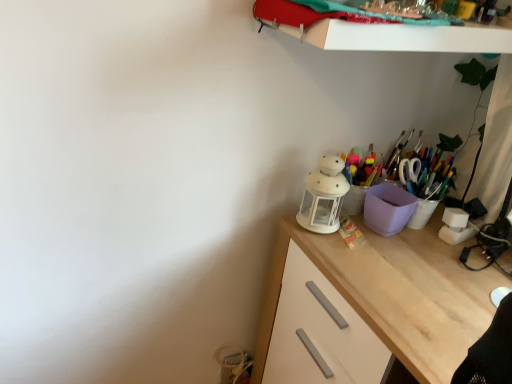
Where is `light wood desk at lower right`? This screenshot has width=512, height=384. light wood desk at lower right is located at coordinates (393, 294).

Describe the element at coordinates (393, 294) in the screenshot. I see `light wood desk at lower right` at that location.

Image resolution: width=512 pixels, height=384 pixels. In order to click on white glossy shelf at upper center in this screenshot , I will do `click(379, 32)`.

This screenshot has width=512, height=384. What do you see at coordinates (379, 32) in the screenshot?
I see `white glossy shelf at upper center` at bounding box center [379, 32].

Measure the distance between white glossy shelf at upper center and camera.

The depth of white glossy shelf at upper center is 28.54 inches.

The width and height of the screenshot is (512, 384). Find the location of `light wood desk at lower right`. light wood desk at lower right is located at coordinates (393, 294).

Is white glossy shelf at upper center to the left of light wood desk at lower right from the viewer's perspective?

Yes, white glossy shelf at upper center is to the left of light wood desk at lower right.

Relative to light wood desk at lower right, is white glossy shelf at upper center in front or behind?

In the image, white glossy shelf at upper center appears in front of light wood desk at lower right.

Is point (275, 14) closer to camera compared to point (452, 246)?

Yes, point (275, 14) is closer to viewer.

From the image's perspective, is white glossy shelf at upper center under light wood desk at lower right?

Actually, white glossy shelf at upper center appears above light wood desk at lower right in the image.

From a real-world perspective, is white glossy shelf at upper center physically below light wood desk at lower right?

No, from a real-world perspective, white glossy shelf at upper center is not under light wood desk at lower right.

In the scene shown: Considering the sizes of objects white glossy shelf at upper center and light wood desk at lower right in the image provided, who is thinner, white glossy shelf at upper center or light wood desk at lower right?

Thinner between the two is white glossy shelf at upper center.

Is white glossy shelf at upper center taller than light wood desk at lower right?

In fact, white glossy shelf at upper center may be shorter than light wood desk at lower right.

Is white glossy shelf at upper center bigger than light wood desk at lower right?

Actually, white glossy shelf at upper center might be smaller than light wood desk at lower right.

Is light wood desk at lower right a part of white glossy shelf at upper center?

Definitely not — light wood desk at lower right is not inside white glossy shelf at upper center.

Is white glossy shelf at upper center beside light wood desk at lower right?

No, white glossy shelf at upper center is not making contact with light wood desk at lower right.

Is white glossy shelf at upper center looking in the opposite direction of light wood desk at lower right?

No, light wood desk at lower right is not at the back of white glossy shelf at upper center.

How different are the orientations of white glossy shelf at upper center and light wood desk at lower right in degrees?

91.6 degrees.

You are a GUI agent. You are given a task and a screenshot of the screen. Output one action in this format:
    pyautogui.click(x=<x>, y=<y>)
    Task: Click on the desk below the white glossy shelf at upper center (from the image's perspective)
    
    Given the screenshot: What is the action you would take?
    pyautogui.click(x=393, y=294)

Visually, is light wood desk at lower right positioned to the left or to the right of white glossy shelf at upper center?

Based on their positions, light wood desk at lower right is located to the right of white glossy shelf at upper center.

Does light wood desk at lower right lie in front of white glossy shelf at upper center?

No, light wood desk at lower right is further to the viewer.

Is point (369, 267) closer to camera compared to point (376, 36)?

No.

From the image's perspective, which one is positioned higher, light wood desk at lower right or white glossy shelf at upper center?

white glossy shelf at upper center, from the image's perspective.

From the picture: From a real-world perspective, is light wood desk at lower right positioned over white glossy shelf at upper center based on gravity?

No, from a real-world perspective, light wood desk at lower right is not on top of white glossy shelf at upper center.

Can you confirm if light wood desk at lower right is wider than white glossy shelf at upper center?

Indeed, light wood desk at lower right has a greater width compared to white glossy shelf at upper center.

Which of these two, light wood desk at lower right or white glossy shelf at upper center, stands taller?

Standing taller between the two is light wood desk at lower right.

Can you confirm if light wood desk at lower right is smaller than white glossy shelf at upper center?

Incorrect, light wood desk at lower right is not smaller in size than white glossy shelf at upper center.

Is white glossy shelf at upper center inside light wood desk at lower right?

Definitely not — white glossy shelf at upper center is not inside light wood desk at lower right.

Is light wood desk at lower right placed right next to white glossy shelf at upper center?

No, light wood desk at lower right is not beside white glossy shelf at upper center.

Is light wood desk at lower right facing towards white glossy shelf at upper center?

No.

How many degrees apart are the facing directions of light wood desk at lower right and white glossy shelf at upper center?

The facing directions of light wood desk at lower right and white glossy shelf at upper center are 91.6 degrees apart.

Locate an element on the screen. desk below the white glossy shelf at upper center (from the image's perspective) is located at coordinates (393, 294).

In order to click on desk on the right of the white glossy shelf at upper center in this screenshot , I will do `click(393, 294)`.

I want to click on shelf above the light wood desk at lower right (from a real-world perspective), so click(x=379, y=32).